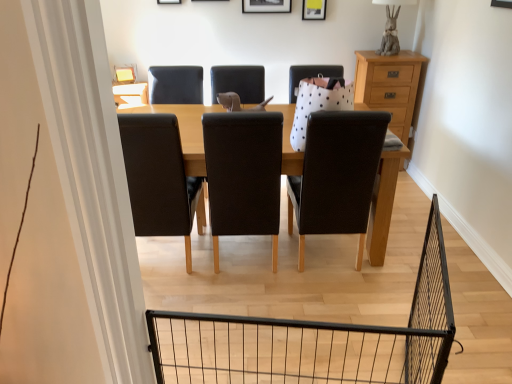
Question: Which direction should I rotate to face matte yellow picture frame at upper center, placed as the first picture frame when sorted from right to left, — up or down?

Choices:
 (A) up
 (B) down

Answer: (A)

Question: Which direction should I rotate to look at black matte picture frame at upper center, positioned as the 1th picture frame in left-to-right order?

Choices:
 (A) right
 (B) left

Answer: (A)

Question: Considering the relative sizes of matte yellow picture frame at upper center, placed as the first picture frame when sorted from right to left, and black matte picture frame at upper center, positioned as the 1th picture frame in left-to-right order, in the image provided, is matte yellow picture frame at upper center, placed as the first picture frame when sorted from right to left, bigger than black matte picture frame at upper center, positioned as the 1th picture frame in left-to-right order,?

Choices:
 (A) yes
 (B) no

Answer: (B)

Question: Does matte yellow picture frame at upper center, placed as the first picture frame when sorted from right to left, have a greater height compared to black matte picture frame at upper center, positioned as the 1th picture frame in left-to-right order?

Choices:
 (A) yes
 (B) no

Answer: (B)

Question: Does matte yellow picture frame at upper center, which ranks as the second picture frame in left-to-right order, have a lesser width compared to black matte picture frame at upper center, which is the second picture frame in right-to-left order?

Choices:
 (A) yes
 (B) no

Answer: (A)

Question: Can you see matte yellow picture frame at upper center, placed as the first picture frame when sorted from right to left, touching black matte picture frame at upper center, positioned as the 1th picture frame in left-to-right order?

Choices:
 (A) no
 (B) yes

Answer: (A)

Question: From the image's perspective, is matte yellow picture frame at upper center, which ranks as the second picture frame in left-to-right order, under black matte picture frame at upper center, which is the second picture frame in right-to-left order?

Choices:
 (A) yes
 (B) no

Answer: (A)

Question: Does matte yellow picture frame at upper center, placed as the first picture frame when sorted from right to left, contain black matte picture frame at upper center, which is the second picture frame in right-to-left order?

Choices:
 (A) yes
 (B) no

Answer: (B)

Question: Does black matte picture frame at upper center, positioned as the 1th picture frame in left-to-right order, lie in front of matte yellow picture frame at upper center, placed as the first picture frame when sorted from right to left?

Choices:
 (A) no
 (B) yes

Answer: (B)

Question: Does black matte picture frame at upper center, which is the second picture frame in right-to-left order, appear on the left side of matte yellow picture frame at upper center, which ranks as the second picture frame in left-to-right order?

Choices:
 (A) no
 (B) yes

Answer: (B)

Question: Is black matte picture frame at upper center, which is the second picture frame in right-to-left order, positioned far away from matte yellow picture frame at upper center, which ranks as the second picture frame in left-to-right order?

Choices:
 (A) no
 (B) yes

Answer: (A)

Question: Does black matte picture frame at upper center, positioned as the 1th picture frame in left-to-right order, have a greater height compared to matte yellow picture frame at upper center, which ranks as the second picture frame in left-to-right order?

Choices:
 (A) yes
 (B) no

Answer: (A)

Question: From the image's perspective, would you say black matte picture frame at upper center, positioned as the 1th picture frame in left-to-right order, is shown under matte yellow picture frame at upper center, placed as the first picture frame when sorted from right to left?

Choices:
 (A) no
 (B) yes

Answer: (A)

Question: Is black matte picture frame at upper center, positioned as the 1th picture frame in left-to-right order, bigger than matte yellow picture frame at upper center, placed as the first picture frame when sorted from right to left?

Choices:
 (A) no
 (B) yes

Answer: (B)

Question: From a real-world perspective, is black matte picture frame at upper center, positioned as the 1th picture frame in left-to-right order, below light brown wooden chest of drawers at right?

Choices:
 (A) yes
 (B) no

Answer: (B)